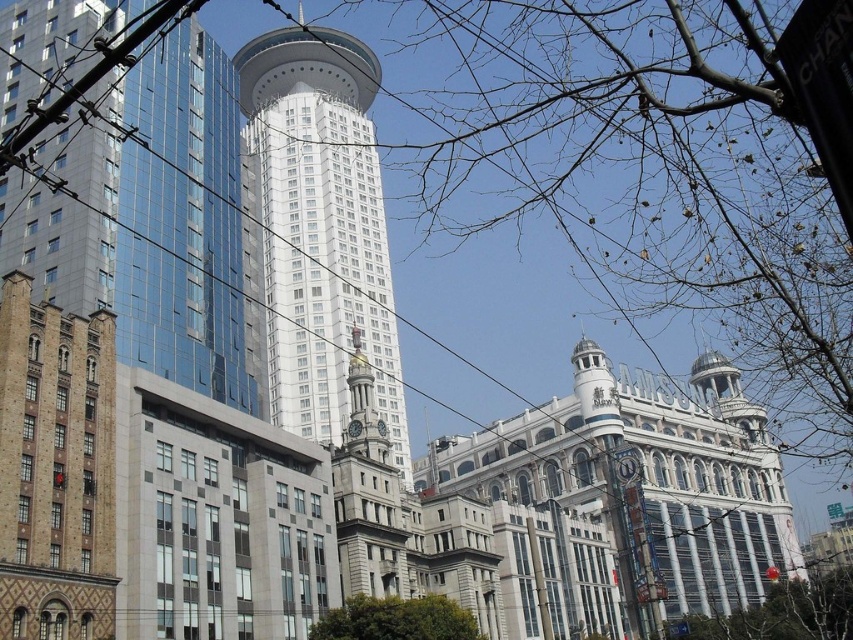
Looking at this image, who is higher up, bare branches at lower right or green leafy tree at lower center?

green leafy tree at lower center is higher up.

Which is more to the left, bare branches at lower right or green leafy tree at lower center?

green leafy tree at lower center is more to the left.

Who is more distant from viewer, (785,621) or (354,604)?

Positioned behind is point (785,621).

This screenshot has height=640, width=853. I want to click on bare branches at lower right, so click(781, 612).

Based on the photo, who is higher up, gold ornate clock tower at center or bare branches at lower right?

gold ornate clock tower at center is above.

Is point (396, 592) farther from camera compared to point (683, 632)?

No, it is not.

The height and width of the screenshot is (640, 853). I want to click on gold ornate clock tower at center, so click(x=367, y=496).

From the picture: Who is positioned more to the right, white glass tower at center or green leafy tree at lower center?

green leafy tree at lower center is more to the right.

Is point (316, 84) more distant than point (410, 605)?

That is True.

The width and height of the screenshot is (853, 640). I want to click on white glass tower at center, so click(320, 228).